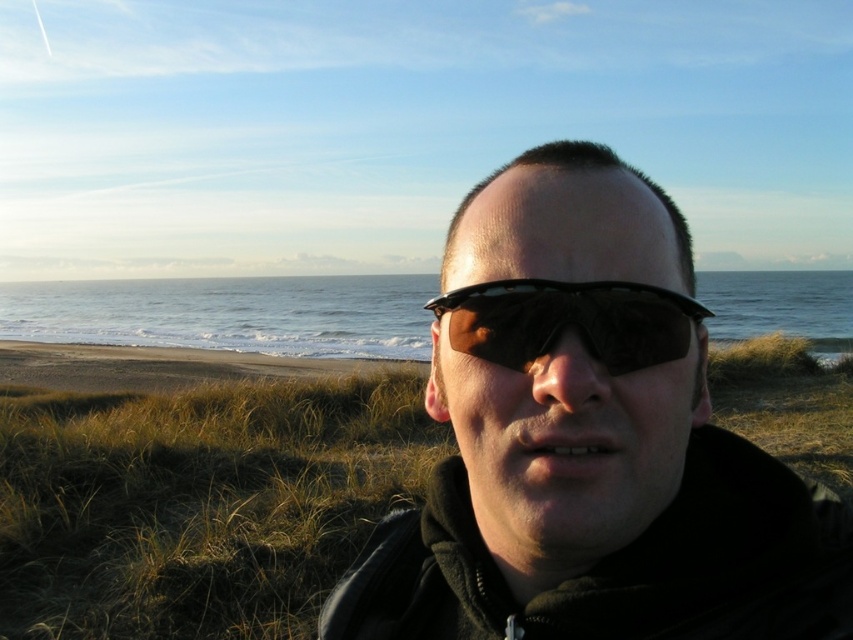
Question: Can you confirm if matte black sunglasses at center is bigger than black reflective sunglasses at center?

Choices:
 (A) no
 (B) yes

Answer: (B)

Question: Does matte black sunglasses at center appear over brown grass at lower center?

Choices:
 (A) yes
 (B) no

Answer: (A)

Question: Does brown grass at lower center appear on the right side of clear blue water at center?

Choices:
 (A) yes
 (B) no

Answer: (A)

Question: Which point is farther to the camera?

Choices:
 (A) black reflective sunglasses at center
 (B) clear blue water at center

Answer: (B)

Question: Which of the following is the closest to the observer?

Choices:
 (A) (53, 595)
 (B) (606, 337)
 (C) (595, 636)

Answer: (B)

Question: Which is farther from the clear blue water at center?

Choices:
 (A) brown grass at lower center
 (B) matte black sunglasses at center

Answer: (B)